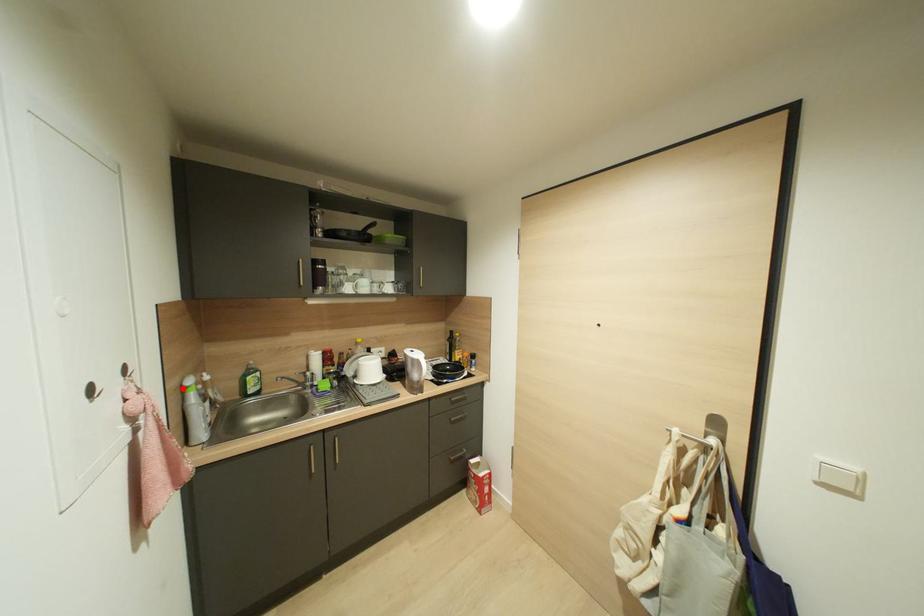
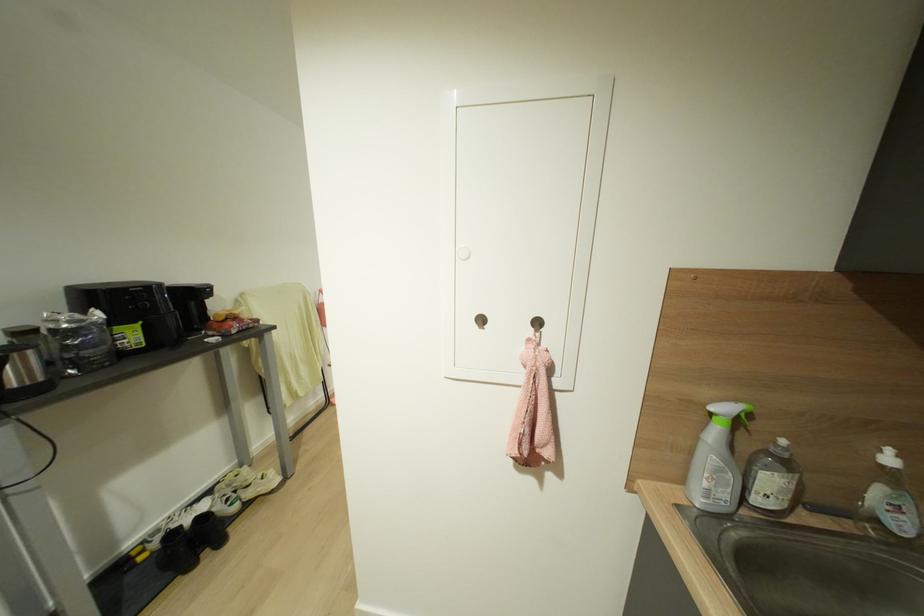
Find the pixel in the second image that matches the highlighted location in the first image.

(711, 411)